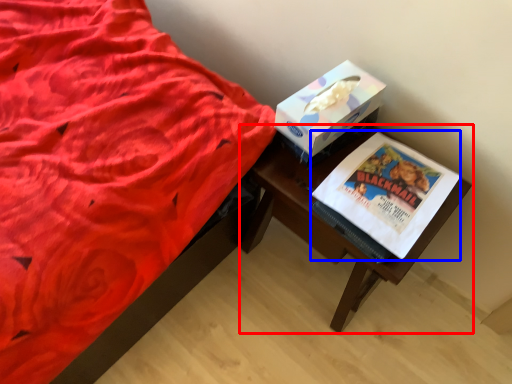
Question: Which object appears farthest to the camera in this image, table (highlighted by a red box) or paperback book (highlighted by a blue box)?

Choices:
 (A) table
 (B) paperback book

Answer: (A)